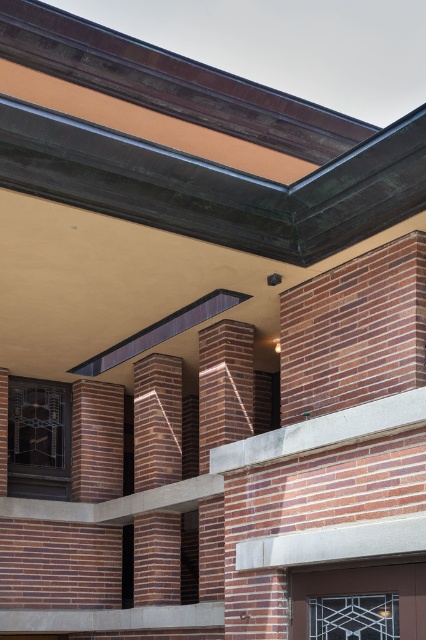
Question: Is red brick wall at upper right positioned behind reddish-brown brick pillar at center?

Choices:
 (A) yes
 (B) no

Answer: (B)

Question: Estimate the real-world distances between objects in this image. Which object is closer to the red brick pillar at center?

Choices:
 (A) reddish-brown brick pillar at center
 (B) red brick wall at upper right

Answer: (A)

Question: Is red brick wall at upper right positioned before reddish-brown brick pillar at center?

Choices:
 (A) no
 (B) yes

Answer: (B)

Question: Which point is closer to the camera?

Choices:
 (A) red brick pillar at center
 (B) red brick wall at upper right

Answer: (B)

Question: Which of the following is the closest to the observer?

Choices:
 (A) red brick pillar at center
 (B) red brick wall at upper right

Answer: (B)

Question: Observing the image, what is the correct spatial positioning of red brick wall at upper right in reference to reddish-brown brick pillar at center?

Choices:
 (A) above
 (B) below

Answer: (A)